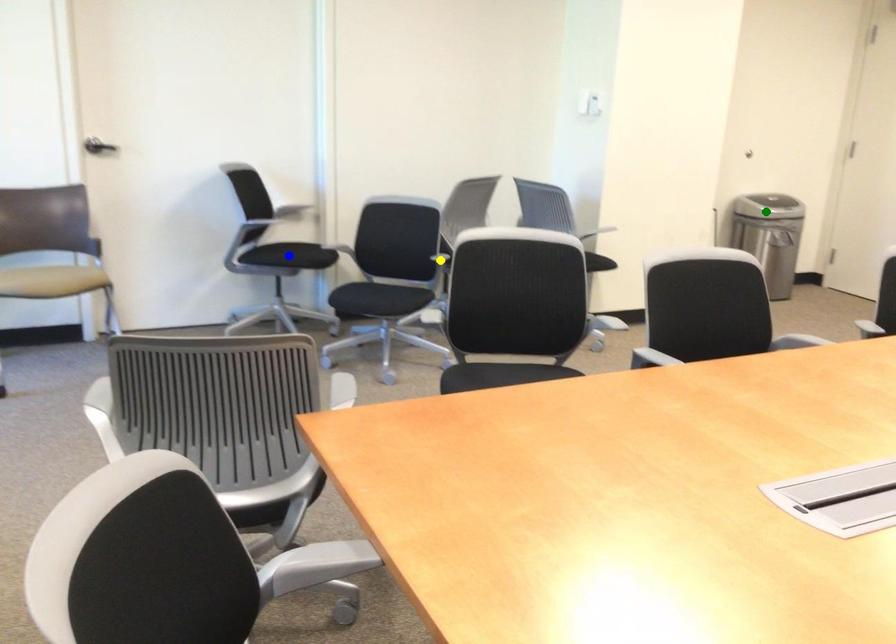
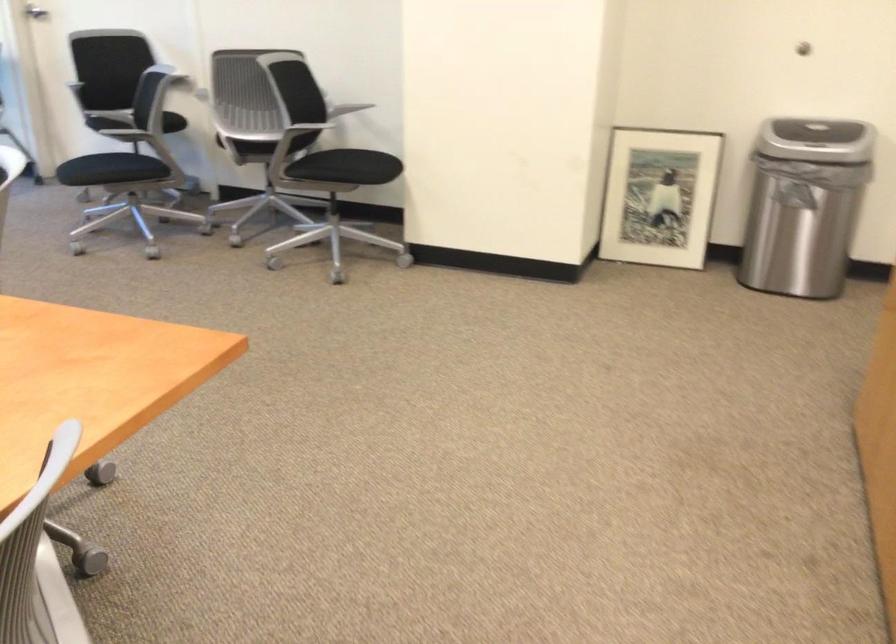
I am providing you with two images of the same scene from different viewpoints. Three points are marked in image1. Which point corresponds to a part or object that is occluded in image2?In image1, three points are marked. Which of them correspond to a part or object that is occluded in image2?Among the three points shown in image1, which one corresponds to a part or object that is no longer visible due to occlusion in image2?

yellow point, green point, blue point cannot be seen in image2.